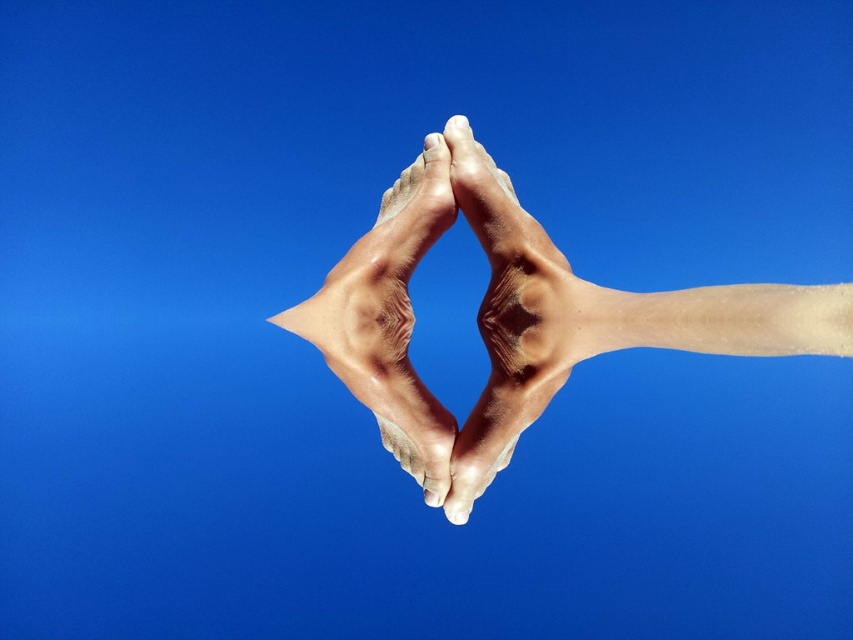
You are a photographer trying to capture the exact location of the point at coordinates point (518, 310) in the scene. Based on the description, where on the hands would this point be located?

The point at coordinates point (518, 310) is located on the smooth skin feet at center.

You are a photographer trying to capture the perfect shot of two hands forming a heart shape. You notice the point between the two hands at point (460,152) is critical for the composition. If your camera requires the distance between the hands to be exactly 3.46 feet for optimal framing, does the current positioning meet this requirement?

Yes, the distance between the two hands at point (460,152) is exactly 3.46 feet, so the current positioning meets the requirement for optimal framing.

You are a photographer trying to capture the closest object in the image. You see the smooth skin feet at center and the smooth skin hand at center. Which one should you focus on to take a clear photo?

The smooth skin feet at center is closer to the viewer than the smooth skin hand at center, so you should focus on the smooth skin feet at center to take a clear photo.